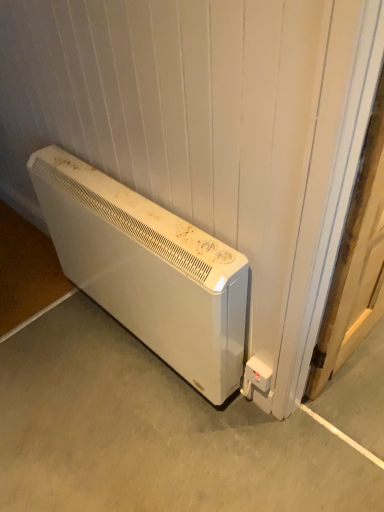
Question: From a real-world perspective, does white plastic electric outlet at lower right sit lower than wooden door at right?

Choices:
 (A) yes
 (B) no

Answer: (A)

Question: Is the surface of white plastic electric outlet at lower right in direct contact with wooden door at right?

Choices:
 (A) yes
 (B) no

Answer: (B)

Question: Could you tell me if white plastic electric outlet at lower right is facing wooden door at right?

Choices:
 (A) yes
 (B) no

Answer: (B)

Question: Is the position of white plastic electric outlet at lower right less distant than that of wooden door at right?

Choices:
 (A) yes
 (B) no

Answer: (B)

Question: Is white plastic electric outlet at lower right outside of wooden door at right?

Choices:
 (A) no
 (B) yes

Answer: (B)

Question: From the image's perspective, is white matte heater at lower left positioned above or below white plastic electric outlet at lower right?

Choices:
 (A) above
 (B) below

Answer: (A)

Question: Is white matte heater at lower left situated inside white plastic electric outlet at lower right or outside?

Choices:
 (A) outside
 (B) inside

Answer: (A)

Question: Considering the positions of point (241, 316) and point (246, 384), is point (241, 316) closer or farther from the camera than point (246, 384)?

Choices:
 (A) farther
 (B) closer

Answer: (B)

Question: Looking at their shapes, would you say white matte heater at lower left is wider or thinner than white plastic electric outlet at lower right?

Choices:
 (A) wide
 (B) thin

Answer: (A)

Question: In terms of size, does white matte heater at lower left appear bigger or smaller than wooden door at right?

Choices:
 (A) small
 (B) big

Answer: (B)

Question: From the image's perspective, is white matte heater at lower left positioned above or below wooden door at right?

Choices:
 (A) below
 (B) above

Answer: (A)

Question: Is white matte heater at lower left situated inside wooden door at right or outside?

Choices:
 (A) outside
 (B) inside

Answer: (A)

Question: Is point (39, 352) positioned closer to the camera than point (370, 187)?

Choices:
 (A) closer
 (B) farther

Answer: (B)

Question: From the image's perspective, is white matte heater at lower left above or below wooden door at right?

Choices:
 (A) below
 (B) above

Answer: (A)

Question: From a real-world perspective, relative to wooden door at right, is white matte heater at lower left vertically above or below?

Choices:
 (A) below
 (B) above

Answer: (A)